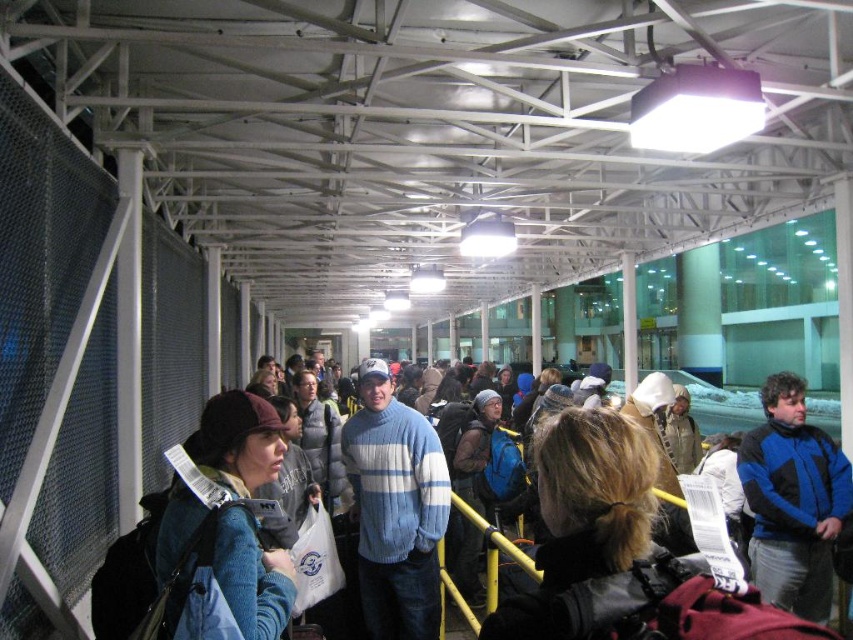
Question: Is cotton sweater at center thinner than blue woolen sweater at center?

Choices:
 (A) yes
 (B) no

Answer: (A)

Question: Which object appears closest to the camera in this image?

Choices:
 (A) cotton sweater at center
 (B) blue woolen sweater at center

Answer: (B)

Question: Estimate the real-world distances between objects in this image. Which object is farther from the blue woolen sweater at center?

Choices:
 (A) blue fleece jacket at center
 (B) cotton sweater at center

Answer: (A)

Question: Is blue fleece jacket at center smaller than blue woolen sweater at center?

Choices:
 (A) no
 (B) yes

Answer: (A)

Question: Can you confirm if cotton sweater at center is wider than blue fleece jacket at center?

Choices:
 (A) no
 (B) yes

Answer: (A)

Question: Among these points, which one is farthest from the camera?

Choices:
 (A) (366, 460)
 (B) (741, 458)
 (C) (248, 488)

Answer: (B)